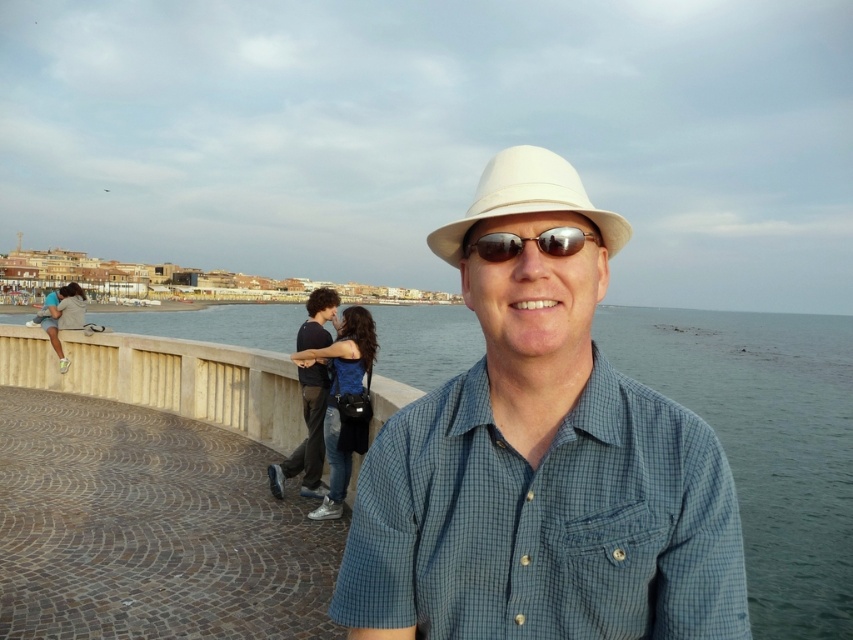
You are standing at the point labeled point (515, 200) and want to walk towards the point labeled point (323, 486). Which direction should you face to move directly towards your destination?

Since point (515, 200) is in front of point (323, 486), you should face backwards to move directly towards point (323, 486).

You are a photographer trying to capture the man in the scene. Since the white matte fedora at center and sunglasses at center are both on his head and face, can you tell me which one is positioned higher?

The white matte fedora at center is above sunglasses at center, so the fedora is higher up on his head compared to the sunglasses.

You are a photographer trying to capture a clear shot of the dark blue jeans at center without the white matte hat at center blocking it. Can you adjust your camera angle to avoid the hat?

The white matte hat at center might be wider than dark blue jeans at center, so adjusting the camera angle might be necessary to ensure the hat does not block the jeans.